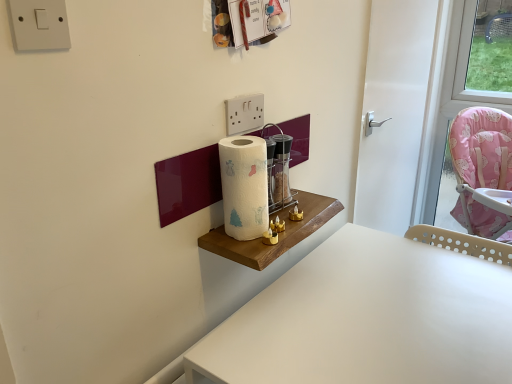
In order to face white glossy door at center, should I rotate leftwards or rightwards?

Rotate right and turn 18.662 degrees.

The height and width of the screenshot is (384, 512). What do you see at coordinates (244, 114) in the screenshot? I see `white plastic/light switch at upper center` at bounding box center [244, 114].

In order to face transparent glass wine bottle at center, should I rotate leftwards or rightwards?

Turn right approximately 3.554 degrees to face it.

What is the approximate height of white paper towel at center?

white paper towel at center is 9.38 inches in height.

The image size is (512, 384). I want to click on white plastic switch at upper left, so 39,24.

Consider the image. Is white paper towel at center taller or shorter than transparent glass wine bottle at center?

Clearly, white paper towel at center is taller compared to transparent glass wine bottle at center.

From the image's perspective, is white paper towel at center under transparent glass wine bottle at center?

Yes, from the image's perspective, white paper towel at center is beneath transparent glass wine bottle at center.

Which object is thinner, white paper towel at center or transparent glass wine bottle at center?

Thinner between the two is transparent glass wine bottle at center.

Is white paper towel at center far away from transparent glass wine bottle at center?

No.

Between white plastic switch at upper left and white plastic table at lower right, which one has less height?

white plastic switch at upper left is shorter.

Would you say white plastic switch at upper left is inside or outside white plastic table at lower right?

white plastic switch at upper left is located beyond the bounds of white plastic table at lower right.

Can white plastic switch at upper left be found inside white plastic table at lower right?

No, white plastic switch at upper left is located outside of white plastic table at lower right.

From their relative heights in the image, would you say white plastic table at lower right is taller or shorter than white plastic switch at upper left?

Considering their sizes, white plastic table at lower right has more height than white plastic switch at upper left.

Between point (392, 294) and point (14, 36), which one is positioned behind?

Point (392, 294)

From the image's perspective, between white plastic table at lower right and white plastic switch at upper left, who is located below?

white plastic table at lower right is shown below in the image.

In the scene shown: Which point is more distant from viewer, (256, 367) or (415, 49)?

The point (415, 49) is farther from the camera.

Are white plastic table at lower right and white glossy door at center far apart?

No, white plastic table at lower right is not far from white glossy door at center.

From a real-world perspective, is white plastic table at lower right on top of white glossy door at center?

No, from a real-world perspective, white plastic table at lower right is not over white glossy door at center

How many degrees apart are the facing directions of white plastic table at lower right and white glossy door at center?

90 degrees.

Which of these two, white paper towel at center or white plastic table at lower right, is thinner?

white paper towel at center.

Considering the sizes of objects white paper towel at center and white plastic table at lower right in the image provided, who is smaller, white paper towel at center or white plastic table at lower right?

Smaller between the two is white paper towel at center.

Is point (229, 194) more distant than point (296, 370)?

Yes, it is.

Consider the image. Could you tell me if white paper towel at center is turned towards white plastic table at lower right?

No, white paper towel at center does not turn towards white plastic table at lower right.

Based on the photo, does white paper towel at center appear on the left side of white plastic/light switch at upper center?

No.

From the image's perspective, which is above, white paper towel at center or white plastic/light switch at upper center?

white plastic/light switch at upper center.

Is white paper towel at center with white plastic/light switch at upper center?

No, white paper towel at center is not next to white plastic/light switch at upper center.

Between white paper towel at center and white plastic/light switch at upper center, which one has less height?

With less height is white plastic/light switch at upper center.

Is white plastic switch at upper left thinner than transparent glass wine bottle at center?

Yes, white plastic switch at upper left is thinner than transparent glass wine bottle at center.

How many degrees apart are the facing directions of white plastic switch at upper left and transparent glass wine bottle at center?

The facing directions of white plastic switch at upper left and transparent glass wine bottle at center are 0.0102 degrees apart.

Between white plastic switch at upper left and transparent glass wine bottle at center, which one appears on the left side from the viewer's perspective?

From the viewer's perspective, white plastic switch at upper left appears more on the left side.

Is white plastic switch at upper left facing away from transparent glass wine bottle at center?

No, white plastic switch at upper left is not facing away from transparent glass wine bottle at center.

This screenshot has width=512, height=384. In the image, there is a white paper towel at center. In order to click on wine bottle below it (from a real-world perspective) in this screenshot , I will do `click(281, 171)`.

Where is `electric outlet on the left of the white plastic table at lower right`? Image resolution: width=512 pixels, height=384 pixels. electric outlet on the left of the white plastic table at lower right is located at coordinates (39, 24).

Considering their positions, is white plastic/light switch at upper center positioned further to white plastic switch at upper left than white plastic table at lower right?

white plastic table at lower right.

From the image, which object appears to be nearer to white plastic/light switch at upper center, white glossy door at center or white plastic table at lower right?

The object closer to white plastic/light switch at upper center is white plastic table at lower right.

From the image, which object appears to be nearer to white plastic/light switch at upper center, transparent glass wine bottle at center or white plastic switch at upper left?

transparent glass wine bottle at center is positioned closer to the anchor white plastic/light switch at upper center.

Based on their spatial positions, is transparent glass wine bottle at center or white plastic table at lower right further from white paper towel at center?

white plastic table at lower right is positioned further to the anchor white paper towel at center.

Which object lies nearer to the anchor point white glossy door at center, white paper towel at center or white plastic table at lower right?

The object closer to white glossy door at center is white plastic table at lower right.

Estimate the real-world distances between objects in this image. Which object is further from white glossy door at center, white paper towel at center or transparent glass wine bottle at center?

Based on the image, white paper towel at center appears to be further to white glossy door at center.

Estimate the real-world distances between objects in this image. Which object is further from white glossy door at center, white plastic/light switch at upper center or white paper towel at center?

The object further to white glossy door at center is white paper towel at center.

From the image, which object appears to be farther from white paper towel at center, white plastic table at lower right or white plastic switch at upper left?

Based on the image, white plastic switch at upper left appears to be further to white paper towel at center.

At what (x,y) coordinates should I click in order to perform the action: click on light switch between white plastic switch at upper left and transparent glass wine bottle at center along the z-axis. Please return your answer as a coordinate pair (x, y). This screenshot has height=384, width=512. Looking at the image, I should click on (244, 114).

The height and width of the screenshot is (384, 512). Identify the location of paper towel between white plastic/light switch at upper center and white plastic table at lower right vertically. [244, 186].

The width and height of the screenshot is (512, 384). Find the location of `paper towel between white plastic switch at upper left and transparent glass wine bottle at center from front to back`. paper towel between white plastic switch at upper left and transparent glass wine bottle at center from front to back is located at coordinates (244, 186).

Locate an element on the screen. table between white paper towel at center and white glossy door at center is located at coordinates (368, 319).